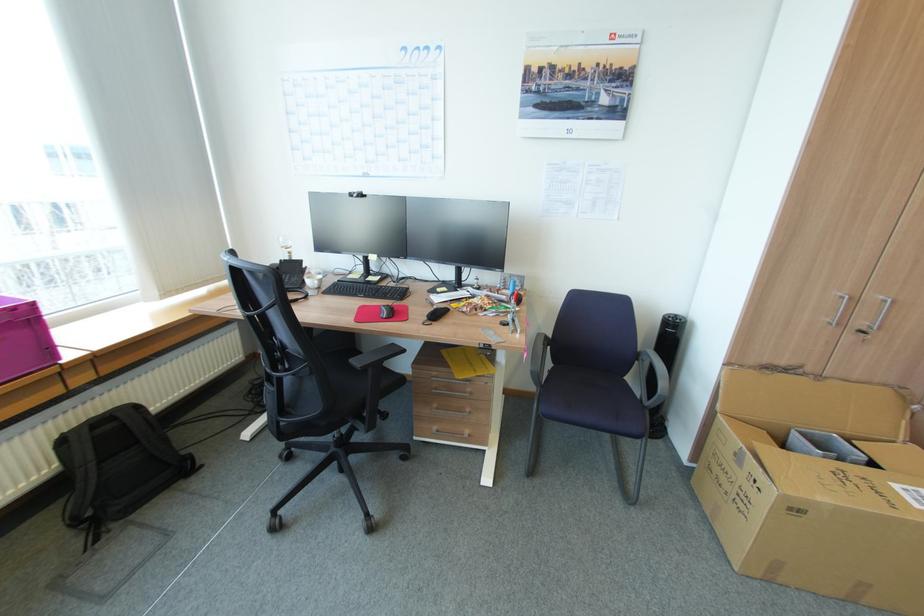
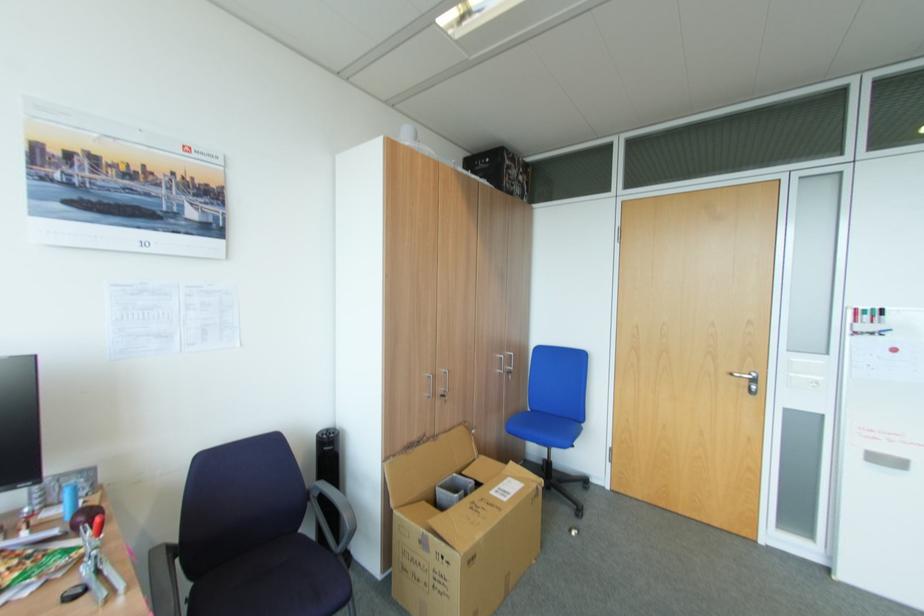
In the second image, find the point that corresponds to point (641, 362) in the first image.

(313, 501)